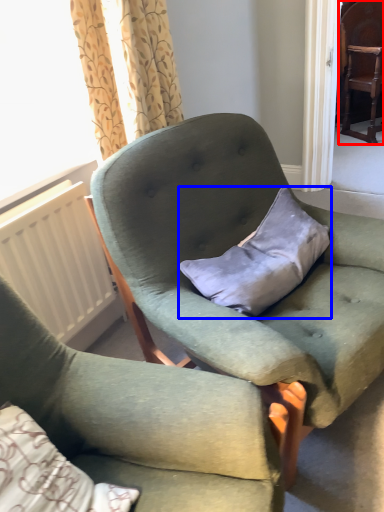
Question: Which of the following is the farthest to the observer, chair (highlighted by a red box) or pillow (highlighted by a blue box)?

Choices:
 (A) chair
 (B) pillow

Answer: (A)